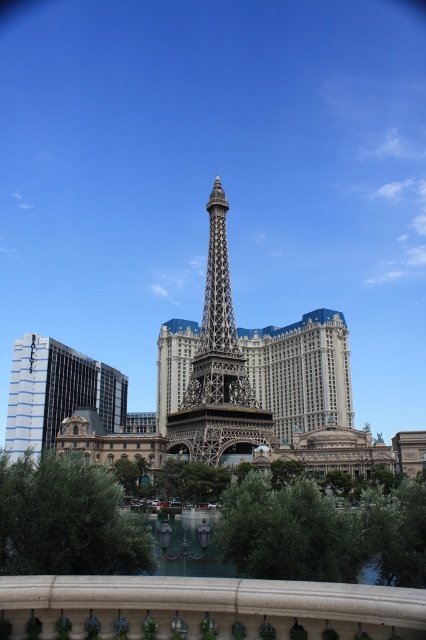
Question: Which point appears closest to the camera in this image?

Choices:
 (A) (207, 346)
 (B) (118, 417)

Answer: (A)

Question: Is white stone balustrade at lower center to the right of metallic gold eiffel tower at center from the viewer's perspective?

Choices:
 (A) no
 (B) yes

Answer: (B)

Question: Does metallic gold eiffel tower at center appear over glassy blue skyscraper at left?

Choices:
 (A) no
 (B) yes

Answer: (B)

Question: Among these objects, which one is nearest to the camera?

Choices:
 (A) white stone balustrade at lower center
 (B) metallic gold eiffel tower at center
 (C) glassy blue skyscraper at left

Answer: (A)

Question: Can you confirm if white stone balustrade at lower center is wider than glassy blue skyscraper at left?

Choices:
 (A) yes
 (B) no

Answer: (B)

Question: Estimate the real-world distances between objects in this image. Which object is closer to the white stone balustrade at lower center?

Choices:
 (A) metallic gold eiffel tower at center
 (B) glassy blue skyscraper at left

Answer: (A)